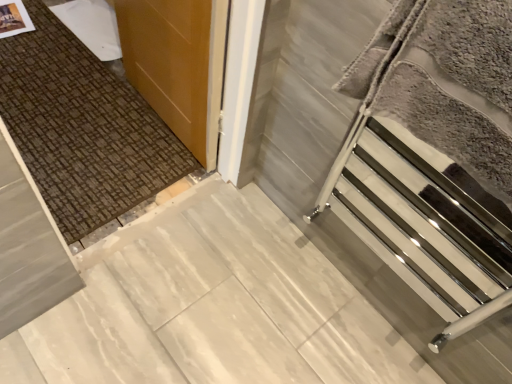
Question: Is wooden door at upper left wider than silver metallic towel rack at right?

Choices:
 (A) no
 (B) yes

Answer: (A)

Question: From a real-world perspective, is wooden door at upper left under silver metallic towel rack at right?

Choices:
 (A) no
 (B) yes

Answer: (B)

Question: From the image's perspective, is wooden door at upper left under silver metallic towel rack at right?

Choices:
 (A) no
 (B) yes

Answer: (A)

Question: Is wooden door at upper left at the left side of silver metallic towel rack at right?

Choices:
 (A) no
 (B) yes

Answer: (B)

Question: Can silver metallic towel rack at right be found inside wooden door at upper left?

Choices:
 (A) no
 (B) yes

Answer: (A)

Question: In terms of width, does wooden door at upper left look wider or thinner when compared to white marble concrete at center?

Choices:
 (A) thin
 (B) wide

Answer: (A)

Question: In the image, is wooden door at upper left on the left side or the right side of white marble concrete at center?

Choices:
 (A) left
 (B) right

Answer: (A)

Question: From their relative heights in the image, would you say wooden door at upper left is taller or shorter than white marble concrete at center?

Choices:
 (A) short
 (B) tall

Answer: (B)

Question: Considering the positions of wooden door at upper left and white marble concrete at center in the image, is wooden door at upper left bigger or smaller than white marble concrete at center?

Choices:
 (A) small
 (B) big

Answer: (B)

Question: From a real-world perspective, relative to polished chrome towel rack at right, is silver metallic towel rack at right vertically above or below?

Choices:
 (A) above
 (B) below

Answer: (A)

Question: From their relative heights in the image, would you say silver metallic towel rack at right is taller or shorter than polished chrome towel rack at right?

Choices:
 (A) short
 (B) tall

Answer: (A)

Question: Considering the positions of silver metallic towel rack at right and polished chrome towel rack at right in the image, is silver metallic towel rack at right bigger or smaller than polished chrome towel rack at right?

Choices:
 (A) big
 (B) small

Answer: (B)

Question: Is silver metallic towel rack at right situated inside polished chrome towel rack at right or outside?

Choices:
 (A) outside
 (B) inside

Answer: (B)

Question: Is point (142, 89) closer or farther from the camera than point (379, 79)?

Choices:
 (A) farther
 (B) closer

Answer: (A)

Question: Is wooden door at upper left situated inside silver metallic towel rack at right or outside?

Choices:
 (A) inside
 (B) outside

Answer: (B)